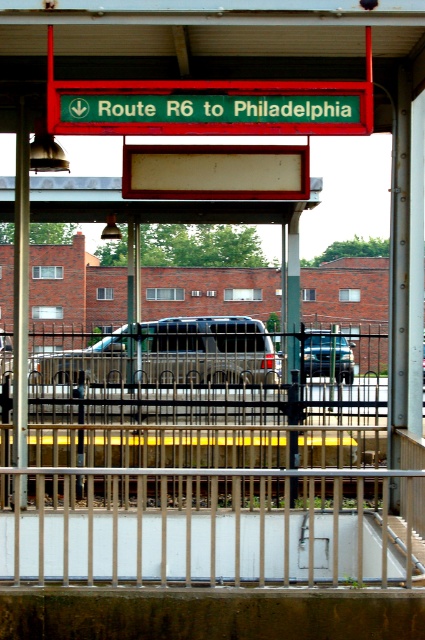
You are standing at the bus stop and need to board the silver metallic suv at center. The white metal rail at center is blocking your path. Can you walk around it? Explain why or why not.

The white metal rail at center is 22.48 feet away from the silver metallic suv at center. Since the rail is only blocking your path if it is between you and the SUV, but the distance suggests they are separated by that distance, you can walk around the rail to reach the silver metallic suv at center.

You are standing at the bus stop platform behind the metal railing. You see a silver metallic suv at center and a metallic silver suv at center. Which one is positioned more to the left?

The silver metallic suv at center is positioned more to the left than the metallic silver suv at center.